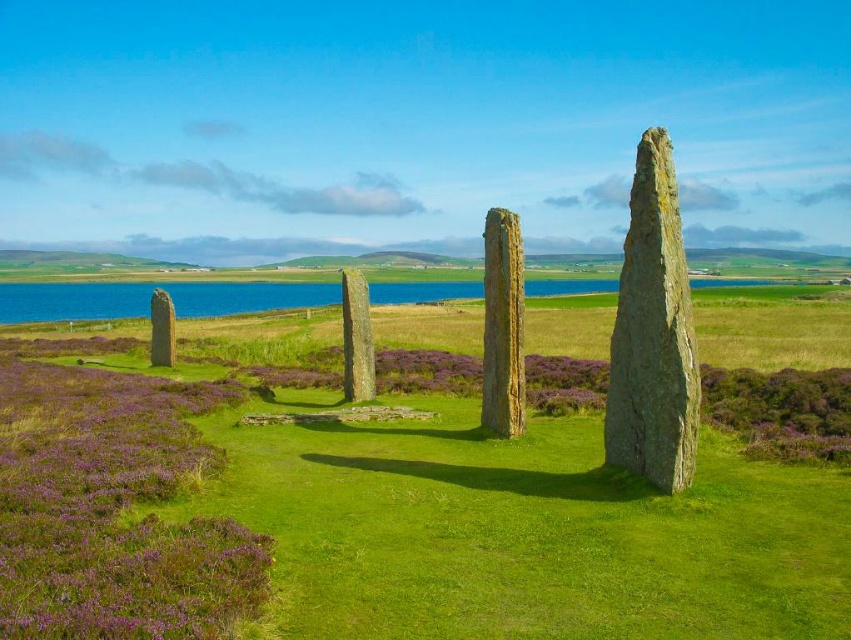
Is smooth stone monolith at center taller than smooth gray stone at left?

Yes, smooth stone monolith at center is taller than smooth gray stone at left.

Can you confirm if smooth stone monolith at center is smaller than smooth gray stone at left?

Yes.

From the picture: Who is more distant from viewer, (649,413) or (151,337)?

Positioned behind is point (151,337).

Find the location of a particular element. This screenshot has width=851, height=640. smooth stone monolith at center is located at coordinates (652, 333).

Can you confirm if purple heather at left is shorter than smooth gray stone at center?

Yes, purple heather at left is shorter than smooth gray stone at center.

Can you confirm if purple heather at left is thinner than smooth gray stone at center?

No, purple heather at left is not thinner than smooth gray stone at center.

Is point (43, 616) less distant than point (361, 308)?

Yes, point (43, 616) is closer to viewer.

Where is `purple heather at left`? purple heather at left is located at coordinates pyautogui.click(x=113, y=509).

Can you confirm if green grassy at center is positioned to the left of smooth stone monolith at center?

Yes, green grassy at center is to the left of smooth stone monolith at center.

Between green grassy at center and smooth stone monolith at center, which one has more height?

smooth stone monolith at center

Describe the element at coordinates (381, 518) in the screenshot. I see `green grassy at center` at that location.

You are a GUI agent. You are given a task and a screenshot of the screen. Output one action in this format:
    pyautogui.click(x=<x>, y=<y>)
    Task: Click on the green grassy at center
    This screenshot has height=640, width=851.
    Given the screenshot: What is the action you would take?
    pyautogui.click(x=381, y=518)